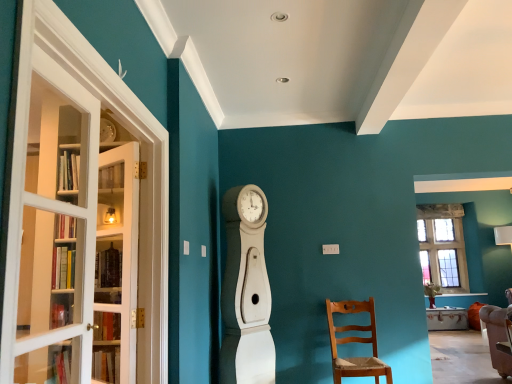
Question: Is white glass screen door at left inside the boundaries of white wood clock at center, or outside?

Choices:
 (A) outside
 (B) inside

Answer: (A)

Question: Considering the positions of white glass screen door at left and white wood clock at center in the image, is white glass screen door at left taller or shorter than white wood clock at center?

Choices:
 (A) tall
 (B) short

Answer: (B)

Question: Estimate the real-world distances between objects in this image. Which object is farther from the light brown wooden chair at lower right?

Choices:
 (A) white glass door at left
 (B) white glass screen door at left
 (C) white wood clock at center

Answer: (B)

Question: Which object is positioned closest to the white glass screen door at left?

Choices:
 (A) white glass door at left
 (B) light brown wooden chair at lower right
 (C) white wood clock at center

Answer: (A)